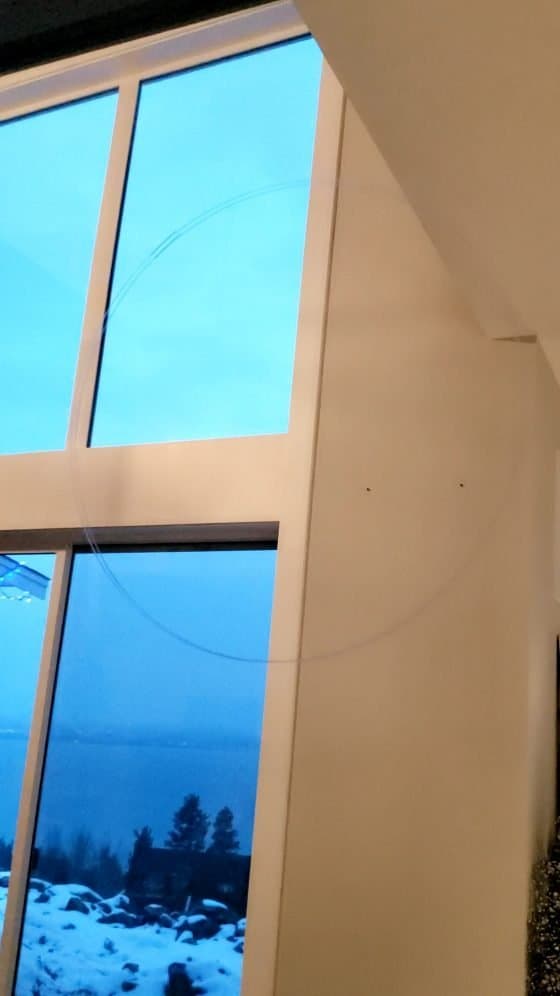
Where is `black ceiling`? black ceiling is located at coordinates coord(96,21).